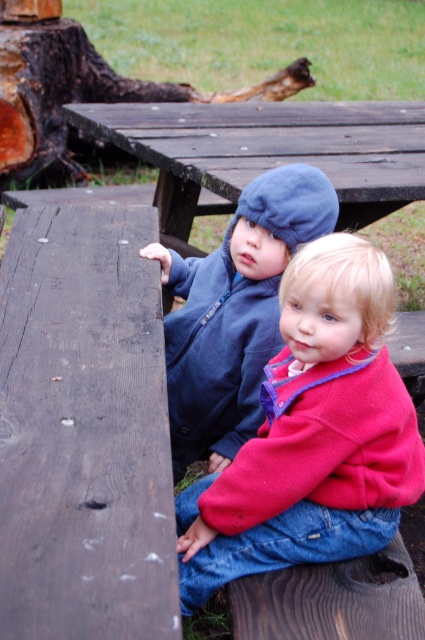
You are standing at the picnic table and want to place a small toy between the two points, point (391, 276) and point (353, 141). Which point should the toy be closer to so it stays in front of both?

The toy should be placed closer to point (391, 276) because it is in front of point (353, 141).

You are a photographer setting up a shot of the two children on the dark brown wooden picnic table at center. You notice the red fleece jacket at center. Which object should you focus on first if you want to capture the smaller one in detail?

The red fleece jacket at center is smaller than the dark brown wooden picnic table at center, so you should focus on the red fleece jacket at center first to capture the smaller one in detail.